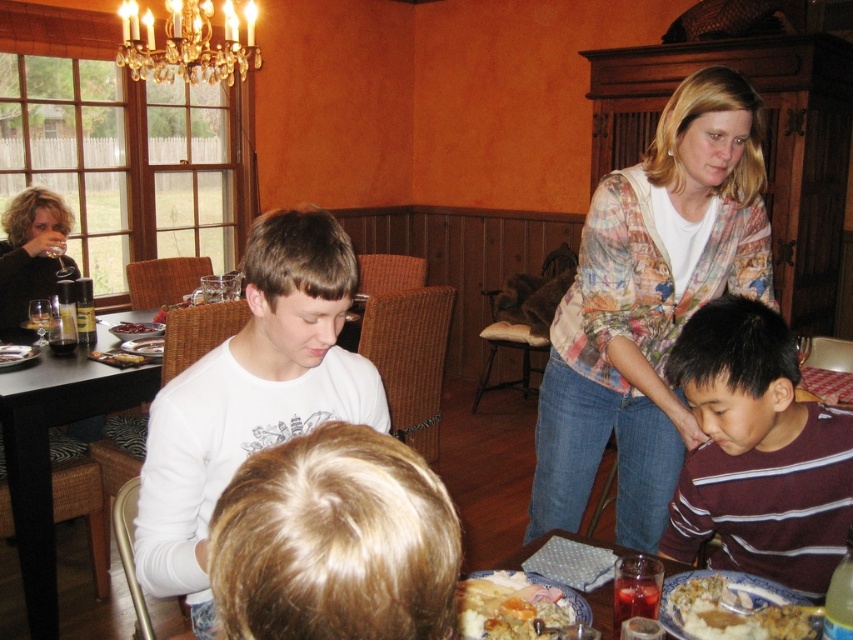
Question: Among these objects, which one is farthest from the camera?

Choices:
 (A) white matte shirt at center
 (B) crystal chandelier at upper left
 (C) translucent glass cup at lower right

Answer: (B)

Question: Is crystal chandelier at upper left closer to camera compared to golden mashed potato at lower right?

Choices:
 (A) yes
 (B) no

Answer: (B)

Question: Is the position of maroon striped shirt at lower right less distant than that of matte silver tray at upper left?

Choices:
 (A) yes
 (B) no

Answer: (A)

Question: Which is nearer to the translucent glass cup at lower right?

Choices:
 (A) printed fabric shirt at upper right
 (B) golden mashed potato at lower right

Answer: (B)

Question: Which object appears closest to the camera in this image?

Choices:
 (A) dark brown sweater at upper left
 (B) maroon striped shirt at lower right

Answer: (B)

Question: Does printed fabric shirt at upper right have a larger size compared to golden mashed potato at lower right?

Choices:
 (A) no
 (B) yes

Answer: (B)